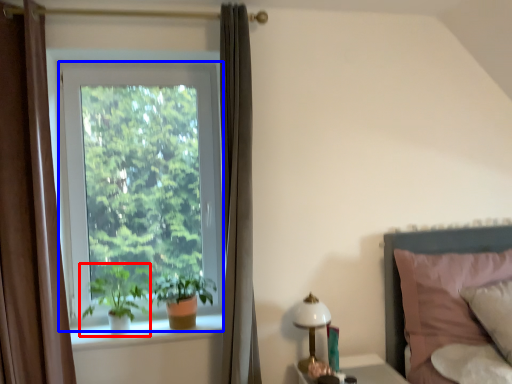
Question: Which point is closer to the camera, houseplant (highlighted by a red box) or window (highlighted by a blue box)?

Choices:
 (A) houseplant
 (B) window

Answer: (A)